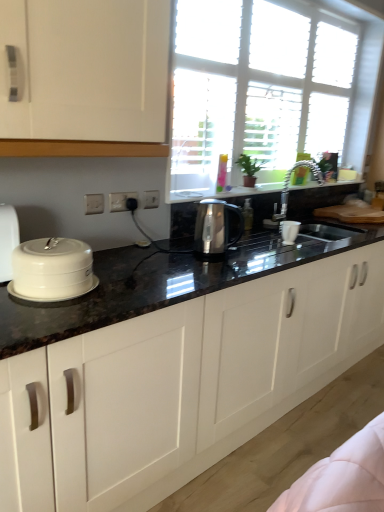
Where is `vacant space to the left of satin metallic kettle at center`? The image size is (384, 512). vacant space to the left of satin metallic kettle at center is located at coordinates (182, 251).